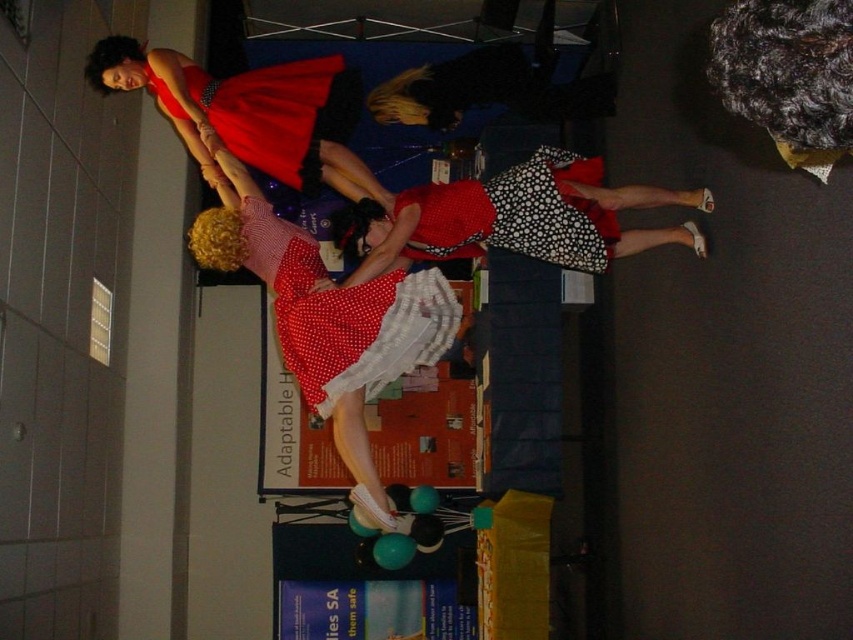
Based on the scene description, which dress is taller when comparing the polka dot fabric dress at center and the black dotted fabric dress at center?

The polka dot fabric dress at center is taller than the black dotted fabric dress at center according to the description.

You are attending a costume party and see two dresses in the image. The black dotted fabric dress at center and the matte red dress at upper left. Which dress is positioned lower in the image?

The black dotted fabric dress at center is located below the matte red dress at upper left, so the black dotted fabric dress at center is positioned lower in the image.